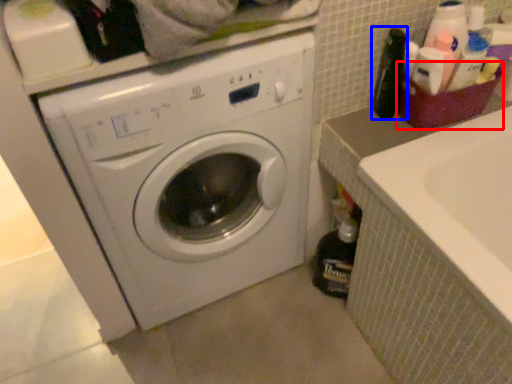
Question: Which point is further to the camera, basket (highlighted by a red box) or bottle (highlighted by a blue box)?

Choices:
 (A) basket
 (B) bottle

Answer: (A)